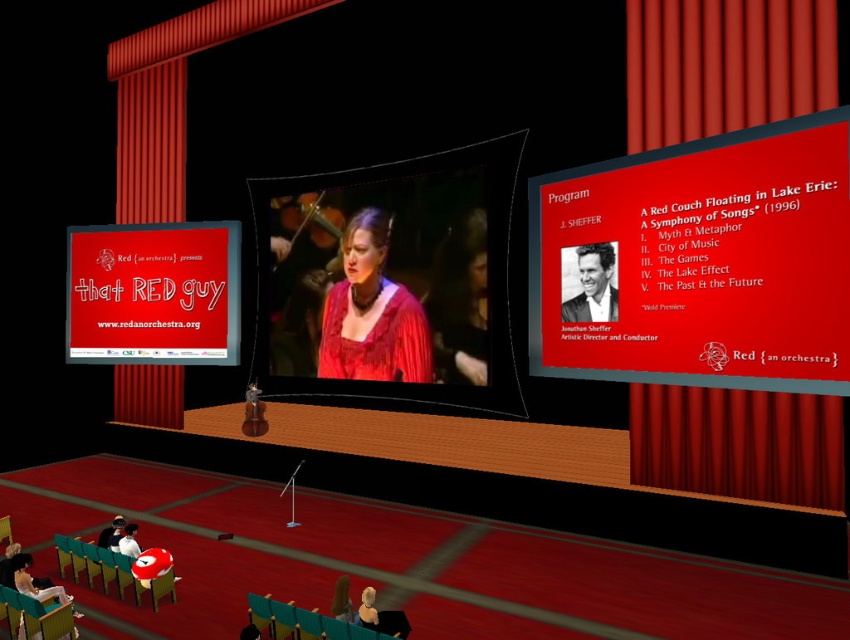
Question: Is matte red program board at upper right positioned before smooth beige head at center?

Choices:
 (A) no
 (B) yes

Answer: (A)

Question: Which of these objects is positioned farthest from the matte red sign at center?

Choices:
 (A) matte red curtain at upper right
 (B) smooth beige sweater at center
 (C) matte red program board at upper right

Answer: (A)

Question: Which point is farther to the camera?

Choices:
 (A) (95, 300)
 (B) (663, 134)
 (C) (789, 360)
 (D) (361, 595)

Answer: (A)

Question: Which point is farther from the camera taking this photo?

Choices:
 (A) (348, 316)
 (B) (367, 611)
 (C) (341, 618)

Answer: (A)

Question: Is the position of smooth matte portrait at center less distant than that of smooth beige sweater at center?

Choices:
 (A) yes
 (B) no

Answer: (B)

Question: Does smooth matte portrait at center appear over smooth beige sweater at center?

Choices:
 (A) yes
 (B) no

Answer: (A)